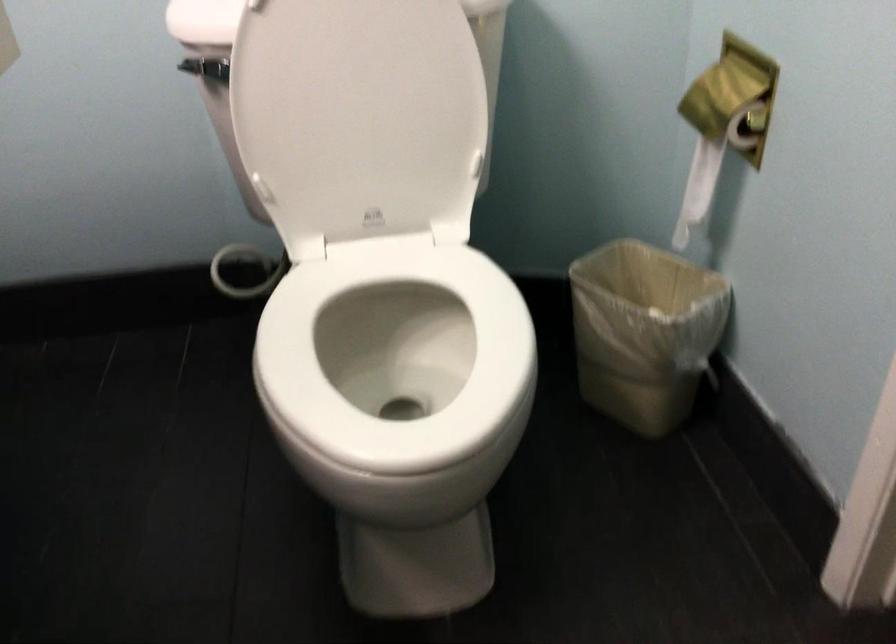
The images are taken continuously from a first-person perspective. In which direction is your viewpoint rotating?

The camera's rotation is toward left-down.